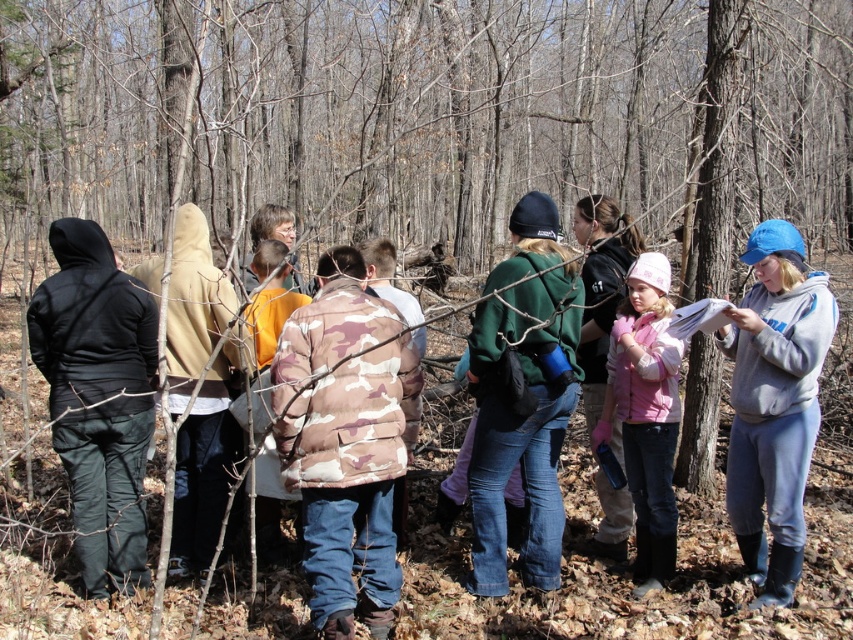
Question: Can you confirm if camo fabric jacket at center is positioned below gray fleece sweatshirt at right?

Choices:
 (A) no
 (B) yes

Answer: (B)

Question: Does camo fabric jacket at center have a larger size compared to pink fleece jacket at center?

Choices:
 (A) no
 (B) yes

Answer: (B)

Question: Which of the following is the farthest from the observer?

Choices:
 (A) gray fleece sweatshirt at right
 (B) pink fleece jacket at center
 (C) green fleece jacket at center

Answer: (B)

Question: Which of the following is the farthest from the observer?

Choices:
 (A) (643, 401)
 (B) (329, 289)
 (C) (775, 538)

Answer: (A)

Question: Is camo fabric jacket at center wider than gray fleece sweatshirt at right?

Choices:
 (A) yes
 (B) no

Answer: (A)

Question: Considering the real-world distances, which object is farthest from the pink fleece jacket at center?

Choices:
 (A) green fleece jacket at center
 (B) camo fabric jacket at center
 (C) gray fleece sweatshirt at right

Answer: (B)